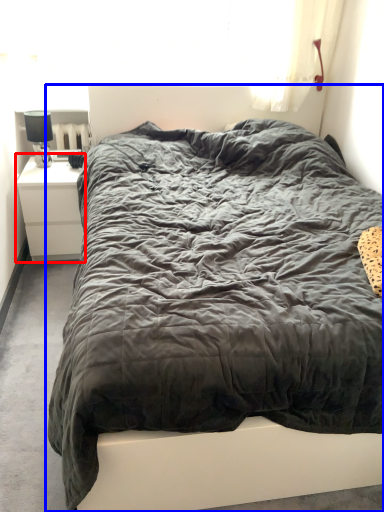
Question: Which of the following is the farthest to the observer, nightstand (highlighted by a red box) or bed (highlighted by a blue box)?

Choices:
 (A) nightstand
 (B) bed

Answer: (A)